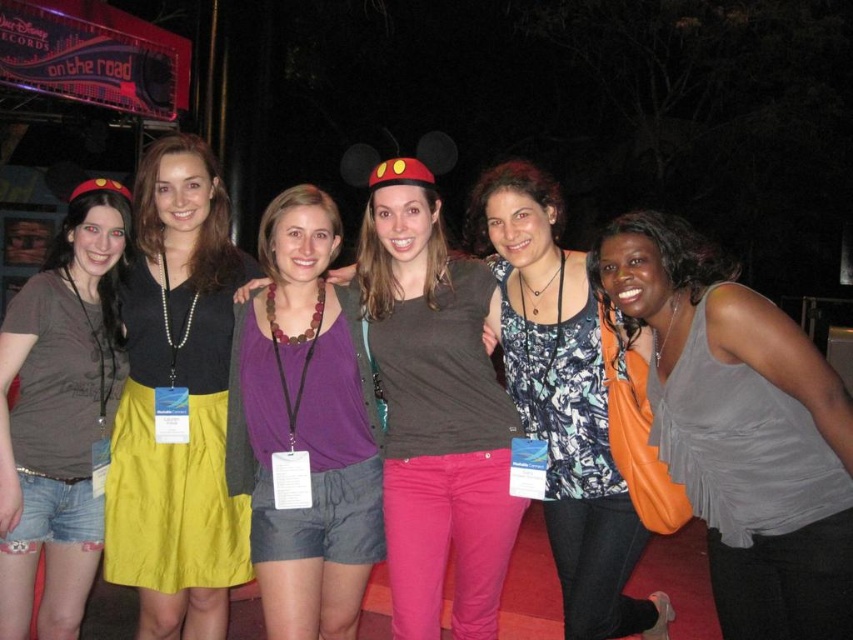
You are a photographer trying to capture a closeup of the gray satin tank top at lower right. Based on its position in the image, what coordinates should you focus on to ensure the tank top is centered in your shot?

The gray satin tank top at lower right is located at coordinates point (741, 429), so you should focus on those coordinates to center it in your shot.

You are a photographer at the event and need to ensure that both the yellow fabric skirt at center and the matte black shirt at center are visible in your photo. Given their sizes, which one might require you to adjust your camera angle to capture fully?

The yellow fabric skirt at center is larger in size than the matte black shirt at center, so you might need to adjust your camera angle to ensure the yellow fabric skirt at center is fully captured in the photo.